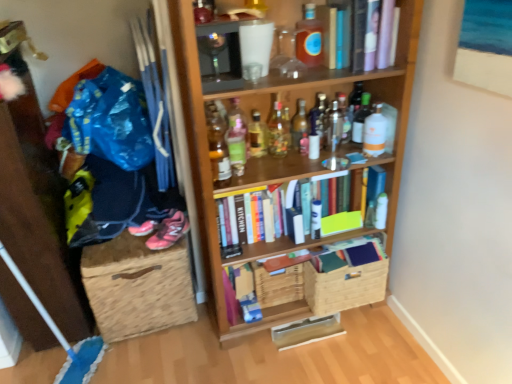
Question: Looking at their shapes, would you say burlap storage box at lower left is wider or thinner than woven brown basket at lower center, which is counted as the second basket, starting from the left?

Choices:
 (A) wide
 (B) thin

Answer: (A)

Question: Is burlap storage box at lower left to the left or to the right of woven brown basket at lower center, the first basket when ordered from right to left, in the image?

Choices:
 (A) right
 (B) left

Answer: (B)

Question: Estimate the real-world distances between objects in this image. Which object is closer to the pink mesh sneakers at lower left?

Choices:
 (A) translucent plastic bottle at upper center, which is the 10th bottle from left to right
 (B) translucent glass bottle at center, which is the 11th bottle from right to left
 (C) clear glass bottle at upper center, placed as the 3th bottle when sorted from right to left
 (D) translucent glass bottle at upper center, which is the eleventh bottle from left to right
 (E) clear glass bottle at center, the fifth bottle when ordered from right to left

Answer: (B)

Question: Which of these objects is positioned closest to the translucent glass bottle at upper center, which is the eleventh bottle from left to right?

Choices:
 (A) translucent plastic bottle at upper center, which is the 10th bottle from left to right
 (B) wooden crate at center, positioned as the 1th basket in left-to-right order
 (C) burlap storage box at lower left
 (D) pink mesh sneakers at lower left
 (E) wooden bookcase at center

Answer: (A)